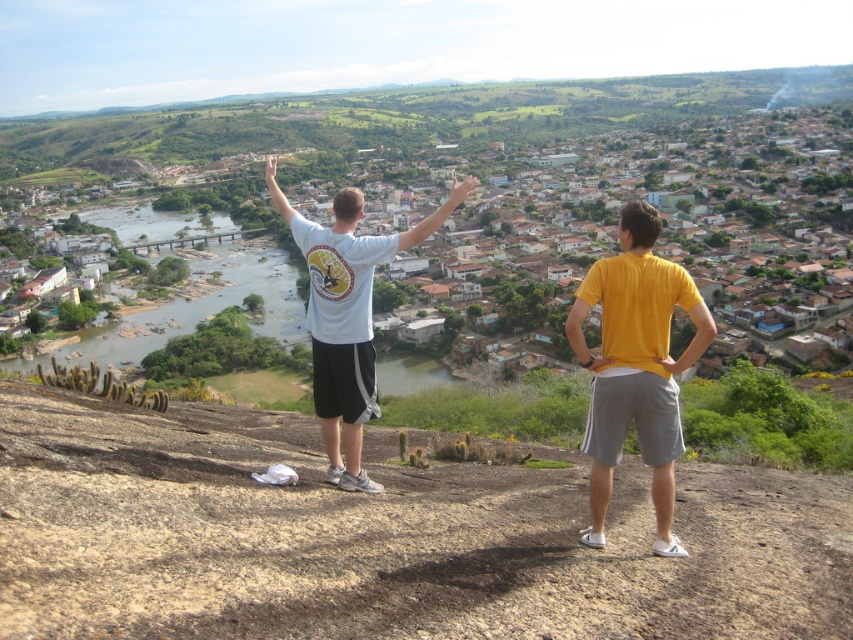
The height and width of the screenshot is (640, 853). Describe the element at coordinates (635, 365) in the screenshot. I see `yellow cotton t-shirt at right` at that location.

Does yellow cotton t-shirt at right have a greater width compared to white t-shirt at center?

No, yellow cotton t-shirt at right is not wider than white t-shirt at center.

Is point (682, 448) behind point (273, 193)?

No, it is in front of (273, 193).

This screenshot has width=853, height=640. I want to click on yellow cotton t-shirt at right, so pos(635,365).